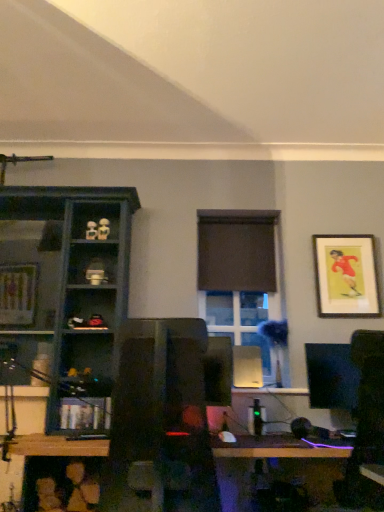
Question: From the image's perspective, is clear glass window at center located beneath brown matte curtain at center?

Choices:
 (A) no
 (B) yes

Answer: (B)

Question: From a real-world perspective, is clear glass window at center positioned under brown matte curtain at center based on gravity?

Choices:
 (A) no
 (B) yes

Answer: (B)

Question: Considering the relative sizes of clear glass window at center and brown matte curtain at center in the image provided, is clear glass window at center smaller than brown matte curtain at center?

Choices:
 (A) yes
 (B) no

Answer: (B)

Question: From the image's perspective, is clear glass window at center on brown matte curtain at center?

Choices:
 (A) no
 (B) yes

Answer: (A)

Question: Would you say clear glass window at center contains brown matte curtain at center?

Choices:
 (A) yes
 (B) no

Answer: (B)

Question: Looking at their shapes, would you say matte dark blue shelf at left, arranged as the first shelf when viewed from the top, is wider or thinner than wooden bookshelf at lower left, the second shelf from the top?

Choices:
 (A) wide
 (B) thin

Answer: (A)

Question: Considering the positions of matte dark blue shelf at left, arranged as the first shelf when viewed from the top, and wooden bookshelf at lower left, the second shelf from the top, in the image, is matte dark blue shelf at left, arranged as the first shelf when viewed from the top, taller or shorter than wooden bookshelf at lower left, the second shelf from the top,?

Choices:
 (A) tall
 (B) short

Answer: (A)

Question: Relative to wooden bookshelf at lower left, the second shelf from the top, is matte dark blue shelf at left, arranged as the first shelf when viewed from the top, in front or behind?

Choices:
 (A) front
 (B) behind

Answer: (A)

Question: From the image's perspective, is matte dark blue shelf at left, arranged as the first shelf when viewed from the top, positioned above or below wooden bookshelf at lower left, the second shelf from the top?

Choices:
 (A) above
 (B) below

Answer: (A)

Question: Is matte white figurine at upper left, arranged as the first toy when viewed from the left, taller or shorter than brown matte curtain at center?

Choices:
 (A) short
 (B) tall

Answer: (A)

Question: In terms of width, does matte white figurine at upper left, acting as the 2th toy starting from the right, look wider or thinner when compared to brown matte curtain at center?

Choices:
 (A) wide
 (B) thin

Answer: (A)

Question: Is point (96, 231) positioned closer to the camera than point (218, 237)?

Choices:
 (A) farther
 (B) closer

Answer: (B)

Question: From a real-world perspective, relative to brown matte curtain at center, is matte white figurine at upper left, acting as the 2th toy starting from the right, vertically above or below?

Choices:
 (A) below
 (B) above

Answer: (B)

Question: Based on their sizes in the image, would you say matte dark blue shelf at left, arranged as the first shelf when viewed from the top, is bigger or smaller than matte white figurine at upper left, placed as the second toy when sorted from left to right?

Choices:
 (A) small
 (B) big

Answer: (B)

Question: Is point (69, 380) positioned closer to the camera than point (109, 230)?

Choices:
 (A) farther
 (B) closer

Answer: (B)